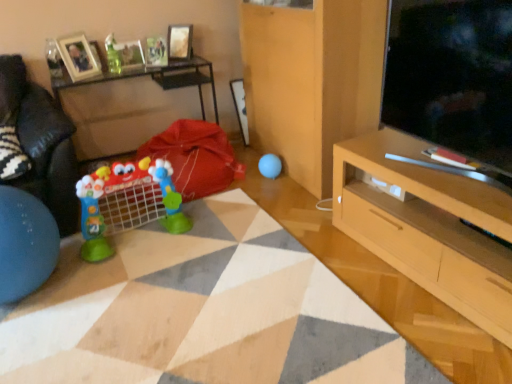
This screenshot has width=512, height=384. Identify the location of vacant area that is in front of blue rubber ball at center, the first toy from the right. (271, 187).